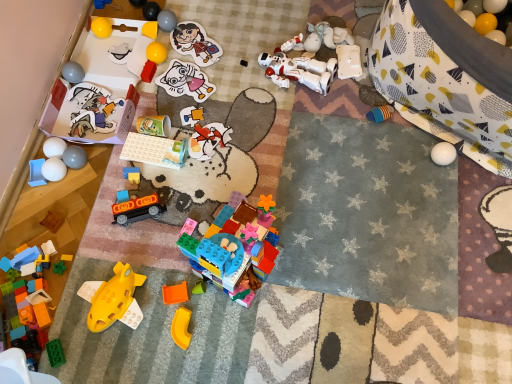
Locate an element on the screen. Image resolution: width=512 pixels, height=384 pixels. free space between matte paper sticker at center, the seventh toy viewed from the right, and translucent orange plastic toy at center, the fourth toy in the right-to-left sequence is located at coordinates (192, 160).